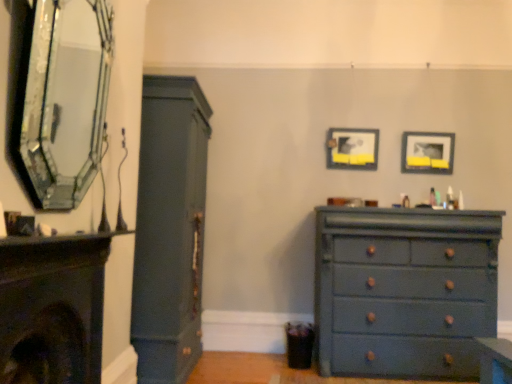
Question: Are matte black fireplace at left, which is the 1th fireplace in top-to-bottom order, and matte dark green cabinet at left located far from each other?

Choices:
 (A) yes
 (B) no

Answer: (B)

Question: Could matte dark green cabinet at left be considered to be inside matte black fireplace at left, the second fireplace in the bottom-to-top sequence?

Choices:
 (A) yes
 (B) no

Answer: (B)

Question: From a real-world perspective, is matte black fireplace at left, the second fireplace in the bottom-to-top sequence, on matte dark green cabinet at left?

Choices:
 (A) no
 (B) yes

Answer: (B)

Question: Does matte black fireplace at left, the second fireplace in the bottom-to-top sequence, turn towards matte dark green cabinet at left?

Choices:
 (A) yes
 (B) no

Answer: (B)

Question: Can you confirm if matte black fireplace at left, which is the 1th fireplace in top-to-bottom order, is bigger than matte dark green cabinet at left?

Choices:
 (A) yes
 (B) no

Answer: (B)

Question: Considering the relative sizes of matte black fireplace at left, the second fireplace in the bottom-to-top sequence, and matte dark green cabinet at left in the image provided, is matte black fireplace at left, the second fireplace in the bottom-to-top sequence, smaller than matte dark green cabinet at left?

Choices:
 (A) yes
 (B) no

Answer: (A)

Question: From the image's perspective, is matte dark blue fireplace at left, acting as the 2th fireplace starting from the top, located beneath matte black picture frame at upper center, arranged as the second picture frame when viewed from the right?

Choices:
 (A) no
 (B) yes

Answer: (B)

Question: Is matte dark blue fireplace at left, acting as the 2th fireplace starting from the top, at the right side of matte black picture frame at upper center, the 1th picture frame viewed from the left?

Choices:
 (A) yes
 (B) no

Answer: (B)

Question: Is matte dark blue fireplace at left, acting as the 2th fireplace starting from the top, positioned beyond the bounds of matte black picture frame at upper center, arranged as the second picture frame when viewed from the right?

Choices:
 (A) yes
 (B) no

Answer: (A)

Question: Are matte dark blue fireplace at left, acting as the 2th fireplace starting from the top, and matte black picture frame at upper center, arranged as the second picture frame when viewed from the right, located far from each other?

Choices:
 (A) no
 (B) yes

Answer: (B)

Question: Is matte dark blue fireplace at left, which appears as the 1th fireplace when ordered from the bottom, positioned before matte black picture frame at upper center, the 1th picture frame viewed from the left?

Choices:
 (A) yes
 (B) no

Answer: (A)

Question: Is matte dark blue fireplace at left, acting as the 2th fireplace starting from the top, facing towards matte black picture frame at upper center, arranged as the second picture frame when viewed from the right?

Choices:
 (A) no
 (B) yes

Answer: (A)

Question: Is matte dark blue fireplace at left, which appears as the 1th fireplace when ordered from the bottom, turned away from matte black fireplace at left, the second fireplace in the bottom-to-top sequence?

Choices:
 (A) no
 (B) yes

Answer: (A)